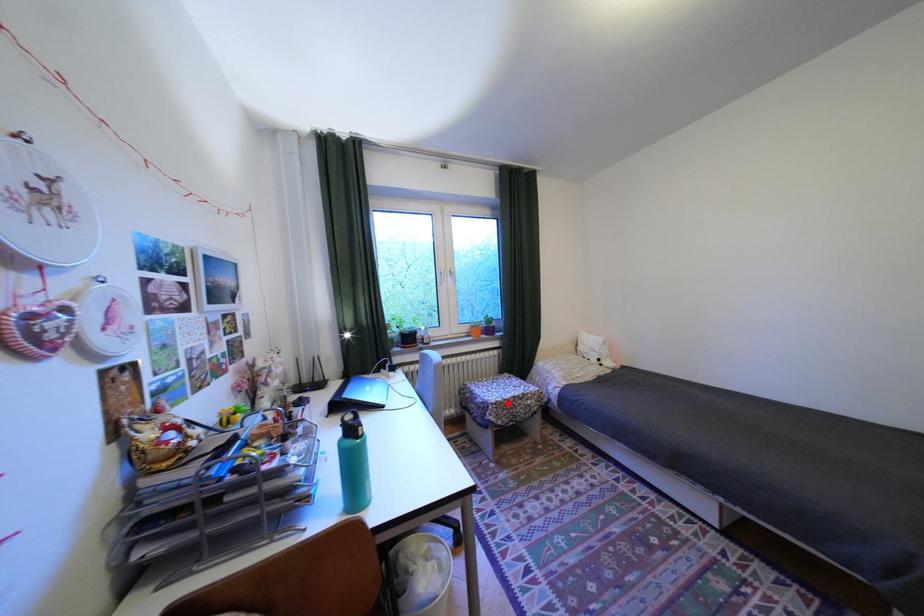
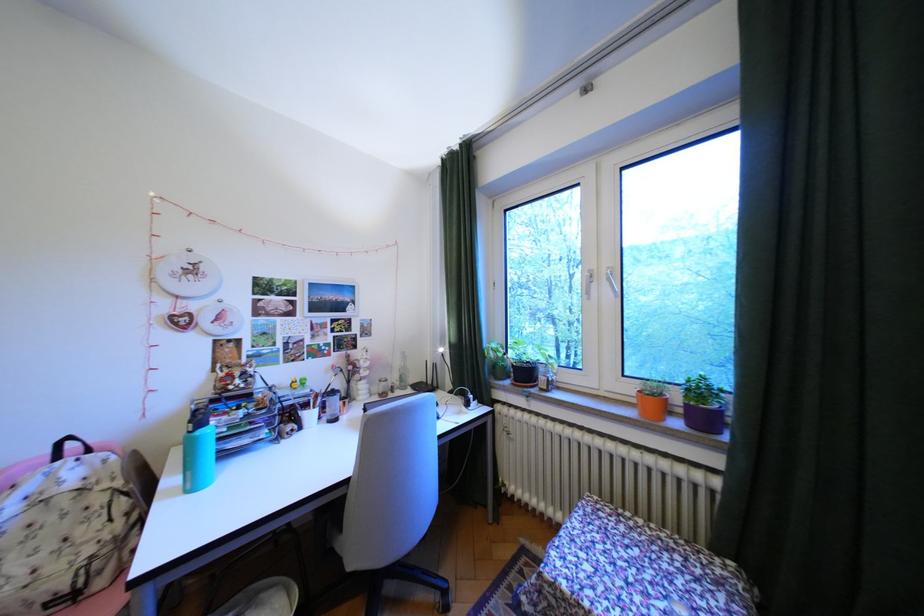
Where in the second image is the point corresponding to the highlighted location from the first image?

(564, 585)